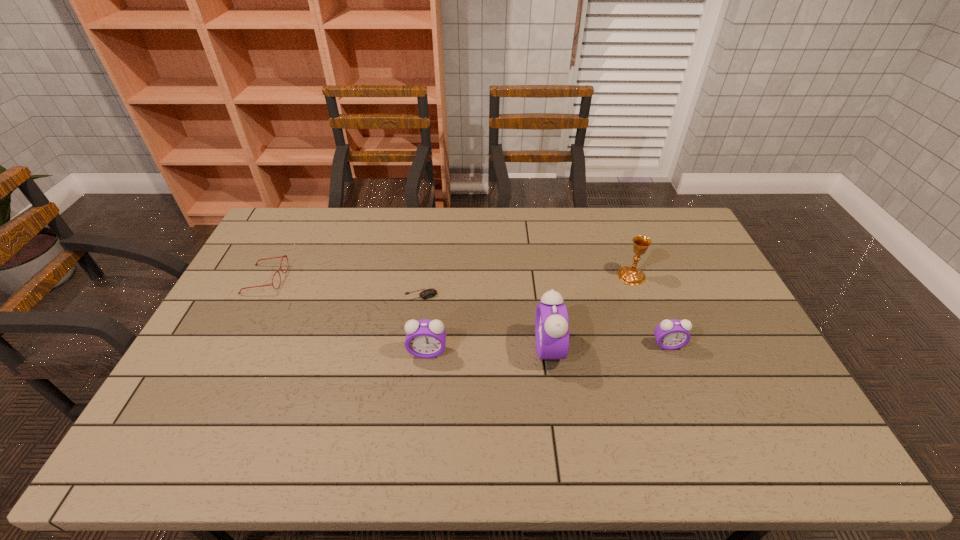
At what (x,y) coordinates should I click in order to perform the action: click on vacant space situated 0.180m on the face of the second tallest alarm clock. Please return your answer as a coordinate pair (x, y). The image size is (960, 540). Looking at the image, I should click on (420, 418).

Where is `free space located on the face of the tallest object`? The width and height of the screenshot is (960, 540). free space located on the face of the tallest object is located at coordinates (512, 348).

Locate an element on the screen. vacant space located on the face of the tallest object is located at coordinates (459, 348).

Find the location of `vacant region located on the face of the tallest object`. vacant region located on the face of the tallest object is located at coordinates (448, 348).

Where is `vacant space located on the face of the third shortest object`? The width and height of the screenshot is (960, 540). vacant space located on the face of the third shortest object is located at coordinates (690, 404).

This screenshot has width=960, height=540. Identify the location of free point located 0.190m on the back of the chalice. (615, 233).

Locate an element on the screen. Image resolution: width=960 pixels, height=540 pixels. vacant space located 0.230m on the back of the mouse is located at coordinates (428, 245).

You are a GUI agent. You are given a task and a screenshot of the screen. Output one action in this format:
    pyautogui.click(x=<x>, y=<y>)
    Task: Click on the vacant space located on the face of the fifth tallest object
    This screenshot has height=540, width=960.
    Given the screenshot: What is the action you would take?
    pyautogui.click(x=398, y=279)

Where is `object that is at the left edge`? Image resolution: width=960 pixels, height=540 pixels. object that is at the left edge is located at coordinates (284, 255).

In order to click on vacant position at the far edge of the desktop in this screenshot , I will do `click(420, 213)`.